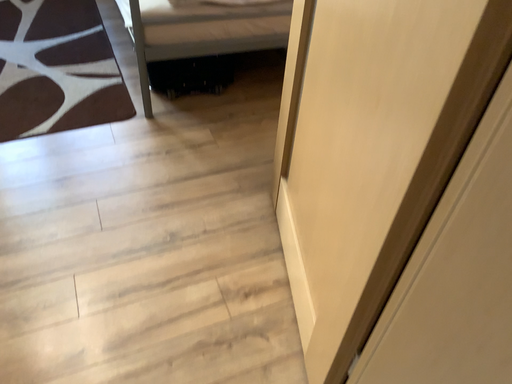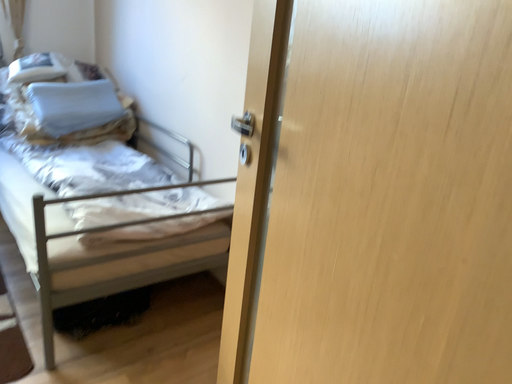
Question: Which way did the camera rotate in the video?

Choices:
 (A) rotated right
 (B) rotated left

Answer: (A)